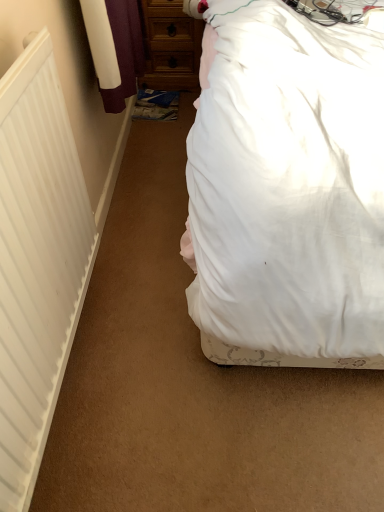
Question: Is wooden chest of drawers at upper center facing away from white matte radiator at left?

Choices:
 (A) no
 (B) yes

Answer: (A)

Question: Is wooden chest of drawers at upper center further to the viewer compared to white matte radiator at left?

Choices:
 (A) yes
 (B) no

Answer: (A)

Question: Can you confirm if wooden chest of drawers at upper center is wider than white matte radiator at left?

Choices:
 (A) no
 (B) yes

Answer: (B)

Question: From the image's perspective, is wooden chest of drawers at upper center located above white matte radiator at left?

Choices:
 (A) yes
 (B) no

Answer: (A)

Question: Is wooden chest of drawers at upper center aimed at white matte radiator at left?

Choices:
 (A) yes
 (B) no

Answer: (A)

Question: Does point (144, 34) appear closer or farther from the camera than point (314, 326)?

Choices:
 (A) farther
 (B) closer

Answer: (A)

Question: Choose the correct answer: Is wooden chest of drawers at upper center inside white fabric bed at upper right or outside it?

Choices:
 (A) outside
 (B) inside

Answer: (A)

Question: Would you say wooden chest of drawers at upper center is to the left or to the right of white fabric bed at upper right in the picture?

Choices:
 (A) right
 (B) left

Answer: (B)

Question: Considering the positions of wooden chest of drawers at upper center and white fabric bed at upper right in the image, is wooden chest of drawers at upper center bigger or smaller than white fabric bed at upper right?

Choices:
 (A) big
 (B) small

Answer: (B)

Question: From a real-world perspective, relative to white fabric bed at upper right, is white matte radiator at left vertically above or below?

Choices:
 (A) above
 (B) below

Answer: (B)

Question: In terms of width, does white matte radiator at left look wider or thinner when compared to white fabric bed at upper right?

Choices:
 (A) thin
 (B) wide

Answer: (A)

Question: Is white matte radiator at left inside or outside of white fabric bed at upper right?

Choices:
 (A) outside
 (B) inside

Answer: (A)

Question: Is white matte radiator at left in front of or behind white fabric bed at upper right in the image?

Choices:
 (A) behind
 (B) front

Answer: (A)

Question: Is white fabric bed at upper right to the left or to the right of wooden chest of drawers at upper center in the image?

Choices:
 (A) left
 (B) right

Answer: (B)

Question: Is white fabric bed at upper right bigger or smaller than wooden chest of drawers at upper center?

Choices:
 (A) small
 (B) big

Answer: (B)